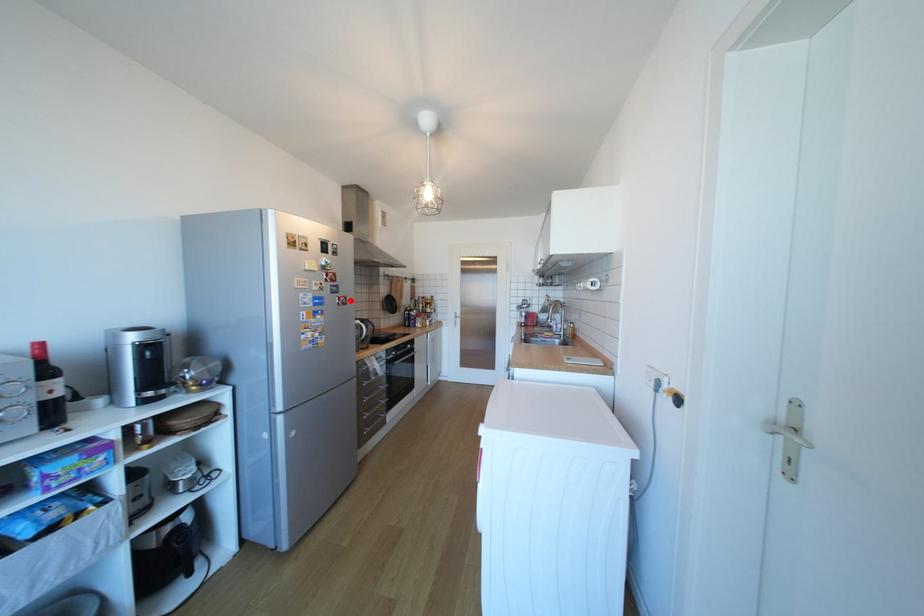
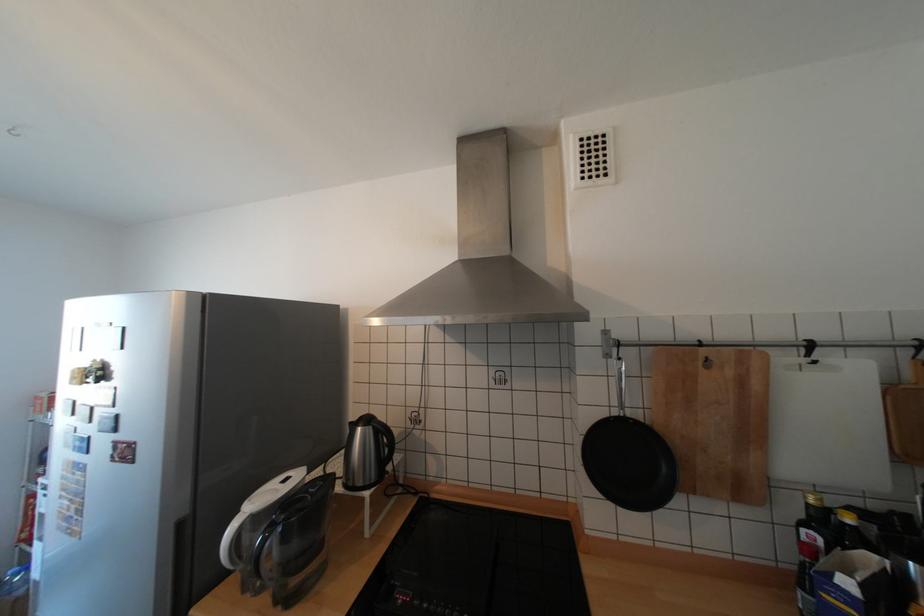
Question: I am providing you with two images of the same scene from different viewpoints. A red point is marked on the first image. At the location where the point appears in image 1, is it still visible in image 2?

Choices:
 (A) Yes
 (B) No

Answer: (A)